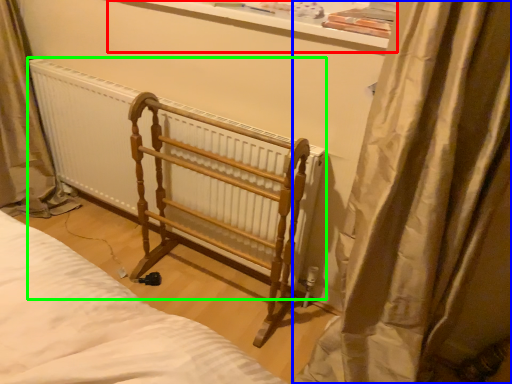
Question: Which is farther away from window sill (highlighted by a red box)? curtain (highlighted by a blue box) or radiator (highlighted by a green box)?

Choices:
 (A) curtain
 (B) radiator

Answer: (B)